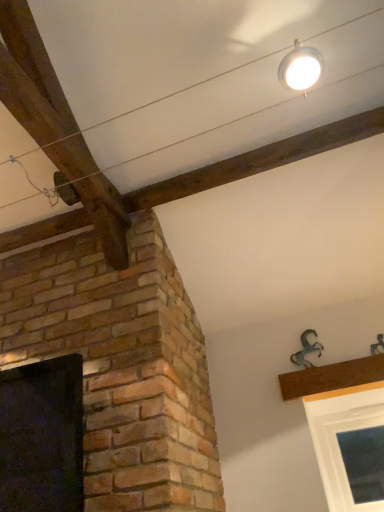
Question: From the image's perspective, is white glossy light fixture at upper center above or below black glass window at left?

Choices:
 (A) above
 (B) below

Answer: (A)

Question: Considering their positions, is white glossy light fixture at upper center located in front of or behind black glass window at left?

Choices:
 (A) front
 (B) behind

Answer: (A)

Question: Would you say white glossy light fixture at upper center is to the left or to the right of black glass window at left in the picture?

Choices:
 (A) left
 (B) right

Answer: (B)

Question: Considering their positions, is black glass window at left located in front of or behind white glossy light fixture at upper center?

Choices:
 (A) front
 (B) behind

Answer: (B)

Question: Based on their sizes in the image, would you say black glass window at left is bigger or smaller than white glossy light fixture at upper center?

Choices:
 (A) big
 (B) small

Answer: (A)

Question: Considering the positions of point (38, 412) and point (301, 64), is point (38, 412) closer or farther from the camera than point (301, 64)?

Choices:
 (A) closer
 (B) farther

Answer: (B)

Question: In the image, is black glass window at left on the left side or the right side of white glossy light fixture at upper center?

Choices:
 (A) left
 (B) right

Answer: (A)